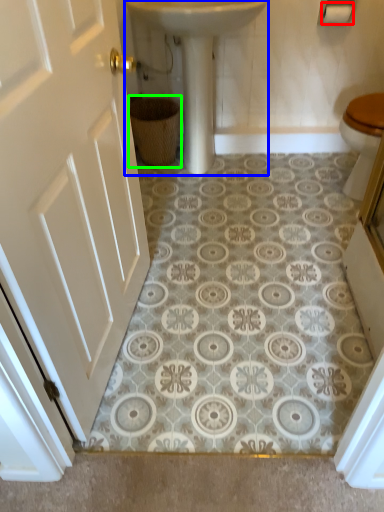
Question: Considering the real-world distances, which object is farthest from toilet paper (highlighted by a red box)? sink (highlighted by a blue box) or basket (highlighted by a green box)?

Choices:
 (A) sink
 (B) basket

Answer: (B)